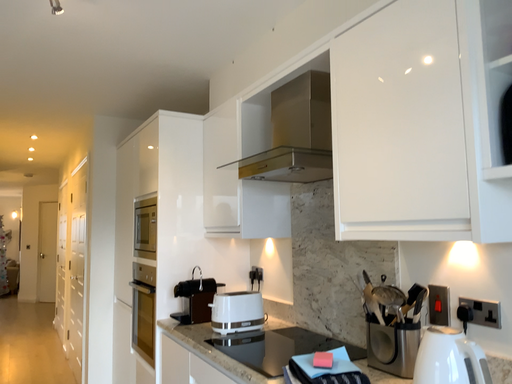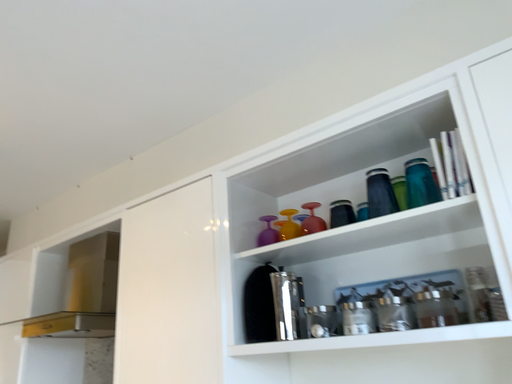
Question: Which way did the camera rotate in the video?

Choices:
 (A) rotated downward
 (B) rotated upward

Answer: (B)